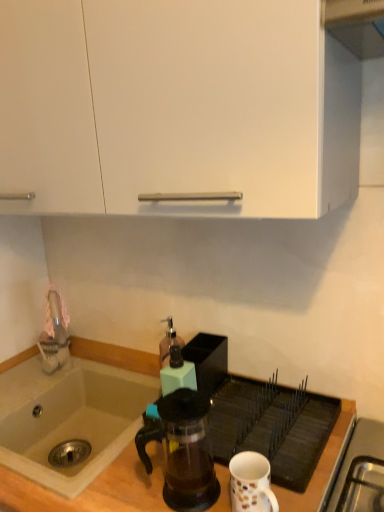
Image resolution: width=384 pixels, height=512 pixels. In order to click on vacant space that is to the left of translucent glass soap dispenser at center, acting as the 1th kitchen appliance starting from the back in this screenshot , I will do `click(134, 371)`.